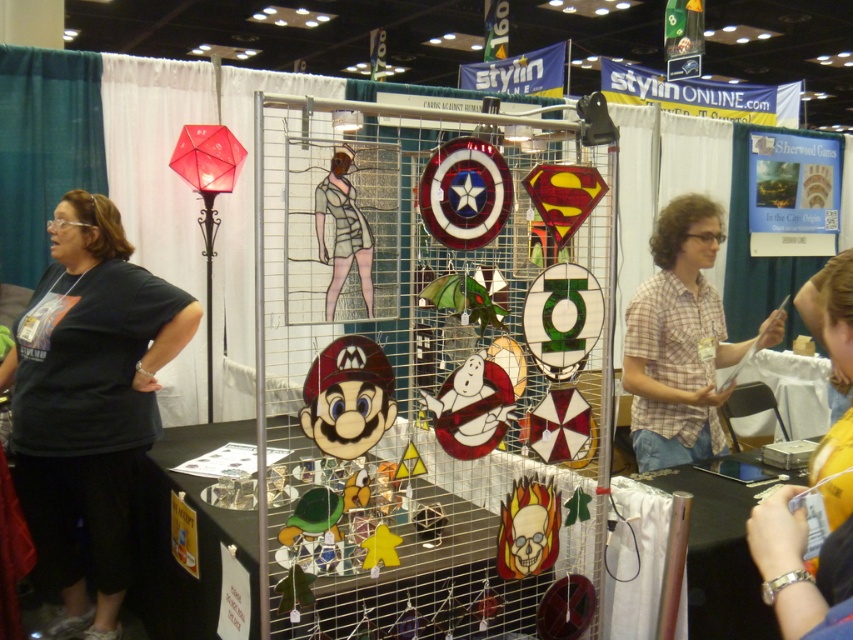
Can you confirm if black fabric shirt at left is positioned above plaid shirt at center?

Incorrect, black fabric shirt at left is not positioned above plaid shirt at center.

Image resolution: width=853 pixels, height=640 pixels. I want to click on black fabric shirt at left, so click(x=88, y=403).